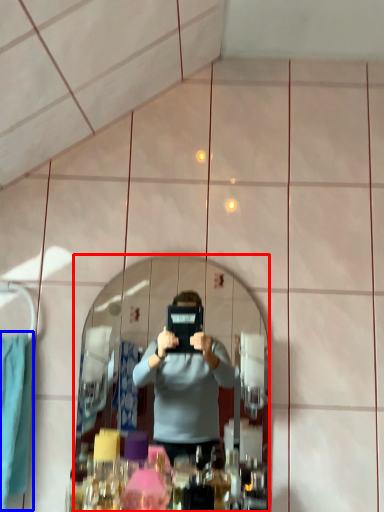
Question: Among these objects, which one is farthest to the camera, mirror (highlighted by a red box) or clothe (highlighted by a blue box)?

Choices:
 (A) mirror
 (B) clothe

Answer: (A)